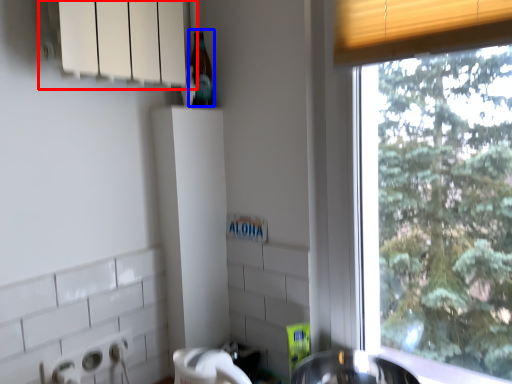
Question: Which of the following is the farthest to the observer, window sill (highlighted by a red box) or bottle (highlighted by a blue box)?

Choices:
 (A) window sill
 (B) bottle

Answer: (B)